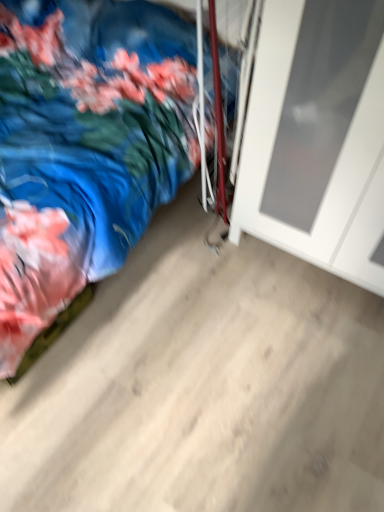
The width and height of the screenshot is (384, 512). I want to click on free space in front of white matte door at right, so click(301, 351).